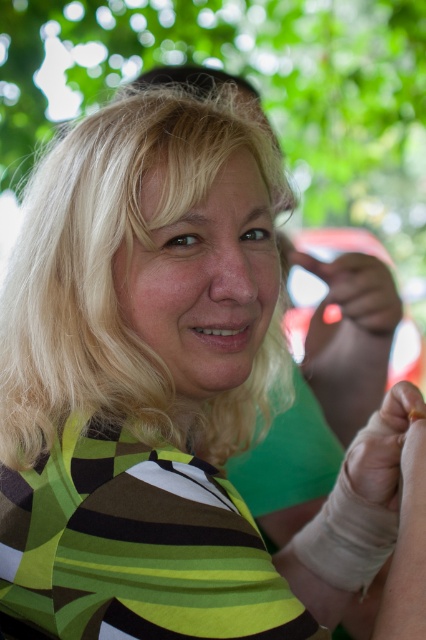
Is white smooth bandage at lower right below smooth yellowish skin at center?

Correct, white smooth bandage at lower right is located below smooth yellowish skin at center.

Does white smooth bandage at lower right have a lesser height compared to smooth yellowish skin at center?

In fact, white smooth bandage at lower right may be taller than smooth yellowish skin at center.

Locate an element on the screen. This screenshot has width=426, height=640. white smooth bandage at lower right is located at coordinates (408, 545).

Does point (23, 317) come closer to viewer compared to point (389, 278)?

Yes, it is in front of point (389, 278).

Can you confirm if blonde hair at center is bigger than smooth white glove at center?

Yes, blonde hair at center is bigger than smooth white glove at center.

The width and height of the screenshot is (426, 640). I want to click on blonde hair at center, so click(x=114, y=284).

Can you confirm if green leafy tree at upper center is wider than smooth yellowish skin at center?

Correct, the width of green leafy tree at upper center exceeds that of smooth yellowish skin at center.

Who is higher up, green leafy tree at upper center or smooth yellowish skin at center?

green leafy tree at upper center is higher up.

Is point (319, 12) farther from camera compared to point (397, 483)?

Yes.

The height and width of the screenshot is (640, 426). I want to click on green leafy tree at upper center, so click(259, 90).